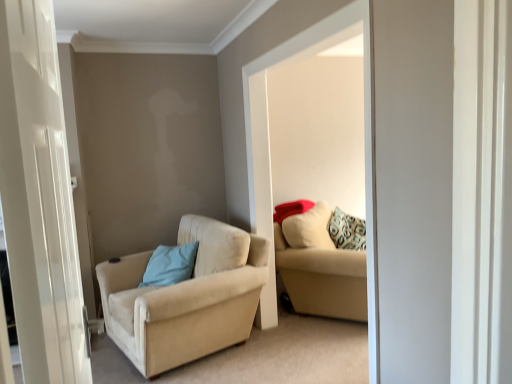
Question: Considering the relative sizes of beige fabric couch at center and beige fabric couch at center in the image provided, is beige fabric couch at center taller than beige fabric couch at center?

Choices:
 (A) yes
 (B) no

Answer: (A)

Question: Could you tell me if beige fabric couch at center is facing beige fabric couch at center?

Choices:
 (A) yes
 (B) no

Answer: (B)

Question: Is beige fabric couch at center wider than beige fabric couch at center?

Choices:
 (A) yes
 (B) no

Answer: (B)

Question: Is beige fabric couch at center far away from beige fabric couch at center?

Choices:
 (A) yes
 (B) no

Answer: (B)

Question: Is beige fabric couch at center bigger than beige fabric couch at center?

Choices:
 (A) yes
 (B) no

Answer: (B)

Question: Is beige fabric couch at center taller or shorter than beige fabric couch at center?

Choices:
 (A) tall
 (B) short

Answer: (A)

Question: Based on their positions, is beige fabric couch at center located to the left or right of beige fabric couch at center?

Choices:
 (A) right
 (B) left

Answer: (B)

Question: From the image's perspective, is beige fabric couch at center positioned above or below beige fabric couch at center?

Choices:
 (A) above
 (B) below

Answer: (A)

Question: Is point (266, 147) positioned closer to the camera than point (316, 241)?

Choices:
 (A) closer
 (B) farther

Answer: (A)

Question: Based on their positions, is beige fabric couch at center located to the left or right of beige fabric chair at left?

Choices:
 (A) left
 (B) right

Answer: (B)

Question: Is beige fabric couch at center taller or shorter than beige fabric chair at left?

Choices:
 (A) short
 (B) tall

Answer: (B)

Question: Considering the positions of point (366, 269) and point (162, 321), is point (366, 269) closer or farther from the camera than point (162, 321)?

Choices:
 (A) farther
 (B) closer

Answer: (B)

Question: From the image's perspective, is beige fabric couch at center positioned above or below beige fabric chair at left?

Choices:
 (A) below
 (B) above

Answer: (B)

Question: From the image's perspective, is light blue fabric pillow at center-left located above or below beige fabric couch at center?

Choices:
 (A) below
 (B) above

Answer: (A)

Question: In terms of size, does light blue fabric pillow at center-left appear bigger or smaller than beige fabric couch at center?

Choices:
 (A) big
 (B) small

Answer: (B)